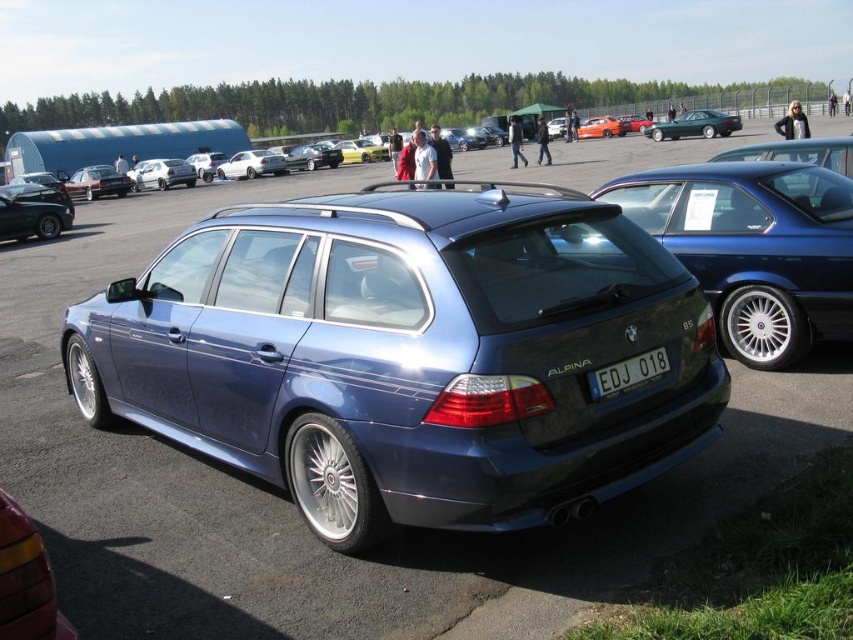
You are a photographer standing at the center of the car exhibition. You want to take a photo of the BMW Alpina B6 Touring with its license plate clearly visible. Where should you position yourself relative to the car to ensure the license plate at point (628, 372) is in the frame?

To capture the license plate at point (628, 372) in the frame, you should position yourself directly in front of the car, aligned with the center of the vehicle. This ensures the license plate at point (628, 372) is clearly visible in the photo.

Looking at this image, you are standing in an outdoor car exhibition and want to take a photo of the satin blue wagon at center. If your camera can focus on objects up to 5 meters away, will you need to move closer to take a clear photo?

The satin blue wagon at center is 4.81 meters away from viewer. Since the camera can focus up to 5 meters, you don not need to move closer as the distance is within the camera range.

You are a photographer trying to capture a clear shot of both the white plastic license plate at center and the metallic green sedan at center. Since you want to focus on the license plate, which object should you adjust your camera focus on first?

The white plastic license plate at center is thinner than the metallic green sedan at center, so you should focus on the metallic green sedan at center first as it is thicker and easier to capture clearly.